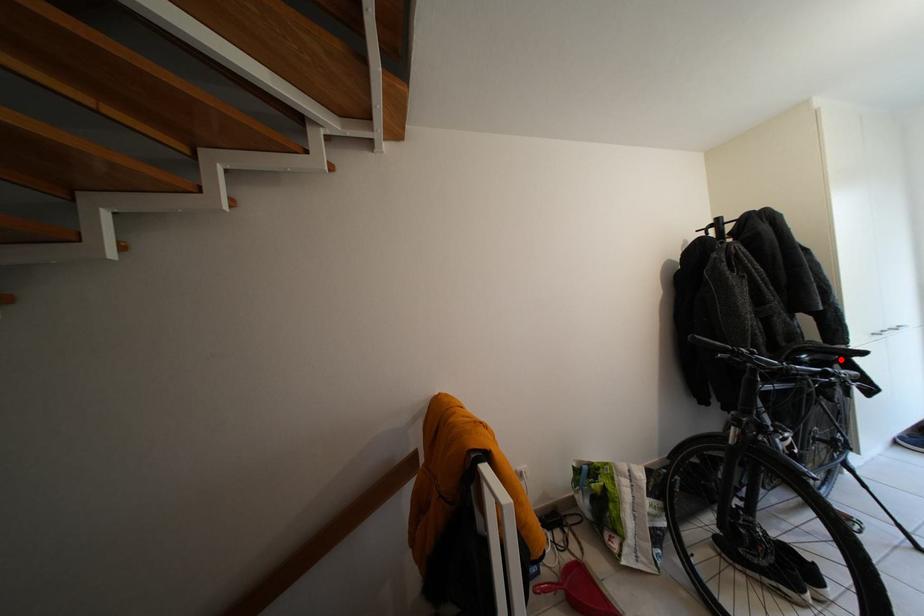
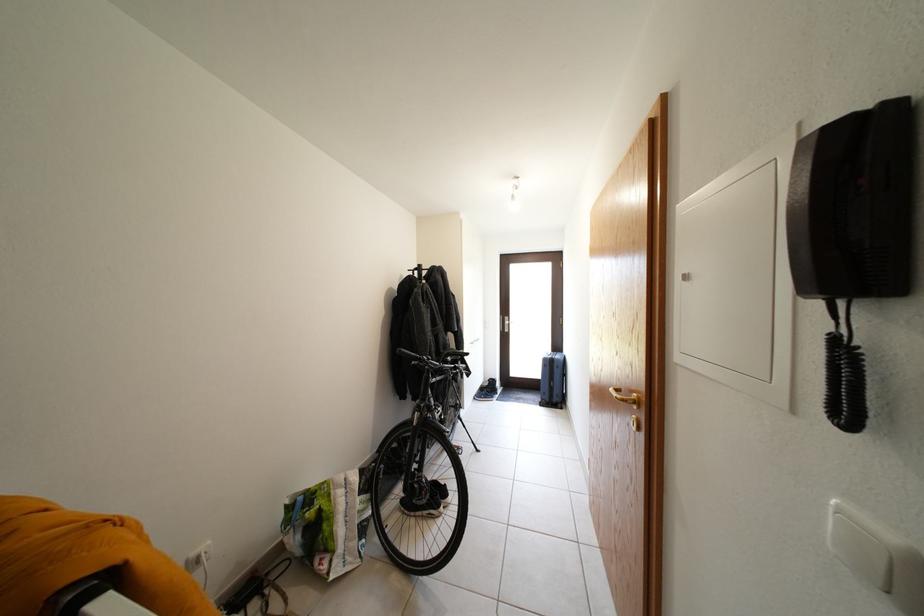
Find the pixel in the second image that matches the highlighted location in the first image.

(467, 361)